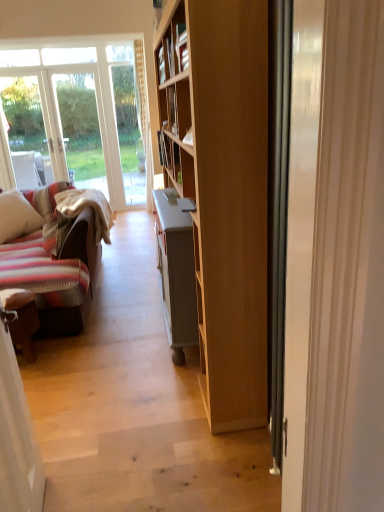
Question: Can you confirm if striped fabric pillow at left is positioned to the right of brown leather chair at lower left?

Choices:
 (A) no
 (B) yes

Answer: (A)

Question: Does striped fabric pillow at left have a lesser width compared to brown leather chair at lower left?

Choices:
 (A) no
 (B) yes

Answer: (A)

Question: From the image's perspective, is striped fabric pillow at left located beneath brown leather chair at lower left?

Choices:
 (A) yes
 (B) no

Answer: (B)

Question: Considering the relative sizes of striped fabric pillow at left and brown leather chair at lower left in the image provided, is striped fabric pillow at left smaller than brown leather chair at lower left?

Choices:
 (A) no
 (B) yes

Answer: (A)

Question: Is striped fabric pillow at left closer to camera compared to brown leather chair at lower left?

Choices:
 (A) yes
 (B) no

Answer: (B)

Question: From a real-world perspective, is striped fabric pillow at left positioned above or below brown leather chair at lower left?

Choices:
 (A) above
 (B) below

Answer: (A)

Question: In the image, is striped fabric pillow at left on the left side or the right side of brown leather chair at lower left?

Choices:
 (A) left
 (B) right

Answer: (A)

Question: Would you say striped fabric pillow at left is inside or outside brown leather chair at lower left?

Choices:
 (A) inside
 (B) outside

Answer: (B)

Question: In terms of width, does striped fabric pillow at left look wider or thinner when compared to brown leather chair at lower left?

Choices:
 (A) wide
 (B) thin

Answer: (A)

Question: Considering their positions, is striped fabric pillow at left located in front of or behind white glossy door at right?

Choices:
 (A) front
 (B) behind

Answer: (B)

Question: From a real-world perspective, is striped fabric pillow at left above or below white glossy door at right?

Choices:
 (A) below
 (B) above

Answer: (A)

Question: Looking at the image, does striped fabric pillow at left seem bigger or smaller compared to white glossy door at right?

Choices:
 (A) small
 (B) big

Answer: (B)

Question: From the image's perspective, relative to white glossy door at right, is striped fabric pillow at left above or below?

Choices:
 (A) above
 (B) below

Answer: (A)

Question: Relative to striped fabric pillow at left, is white glossy door at right in front or behind?

Choices:
 (A) front
 (B) behind

Answer: (A)

Question: Considering the positions of white glossy door at right and striped fabric pillow at left in the image, is white glossy door at right bigger or smaller than striped fabric pillow at left?

Choices:
 (A) small
 (B) big

Answer: (A)